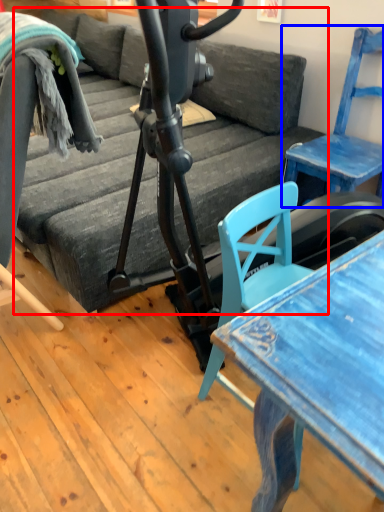
Question: Which object is further to the camera taking this photo, studio couch (highlighted by a red box) or chair (highlighted by a blue box)?

Choices:
 (A) studio couch
 (B) chair

Answer: (B)